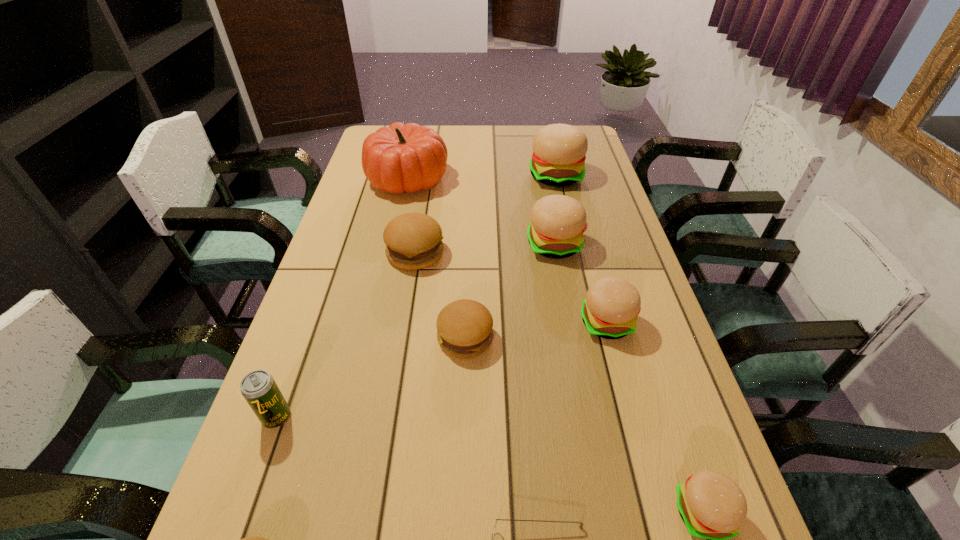
Where is `object that is the third closest to the second nearest hamburger`? The width and height of the screenshot is (960, 540). object that is the third closest to the second nearest hamburger is located at coordinates (464, 327).

Find the location of a particular element. The image size is (960, 540). hamburger that is the fifth nearest to the third farthest beige hamburger is located at coordinates (559, 150).

Identify the location of hamburger identified as the fifth closest to the third farthest beige hamburger. The image size is (960, 540). (559, 150).

Locate an element on the screen. beige hamburger that is the nearest to the farthest hamburger is located at coordinates (558, 222).

Locate which beige hamburger is the fourth closest to the beer can. Please provide its 2D coordinates. Your answer should be formatted as a tuple, i.e. [(x, y)], where the tuple contains the x and y coordinates of a point satisfying the conditions above.

[(559, 150)]

I want to click on the closest brown hamburger relative to the shortest hamburger, so click(x=464, y=327).

You are a GUI agent. You are given a task and a screenshot of the screen. Output one action in this format:
    pyautogui.click(x=<x>, y=<y>)
    Task: Click on the brown hamburger that stands as the closest to the sixth shortest hamburger
    
    Given the screenshot: What is the action you would take?
    pyautogui.click(x=464, y=327)

This screenshot has width=960, height=540. Identify the location of free space that satisfies the following two spatial constraints: 1. on the back side of the second biggest beige hamburger; 2. on the left side of the farthest brown hamburger. (417, 245).